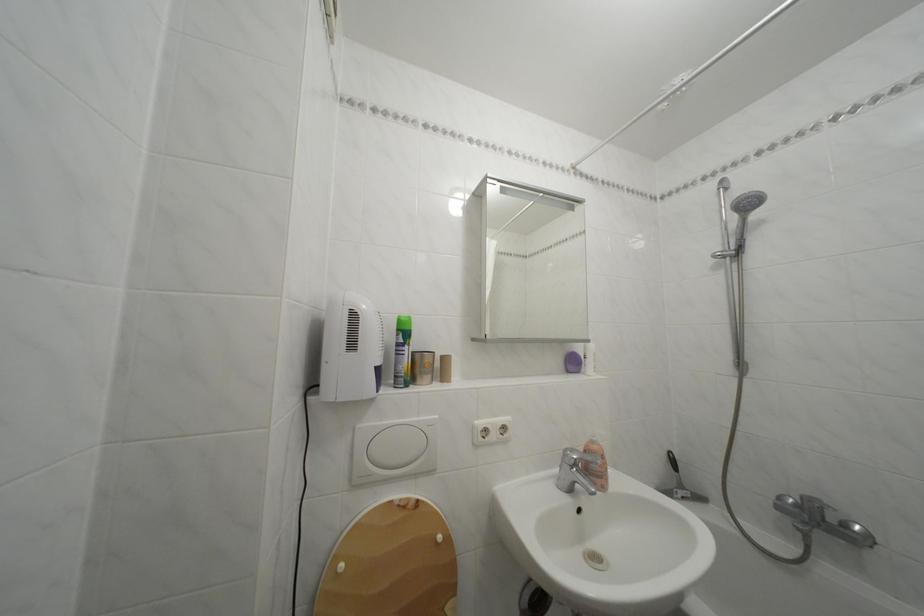
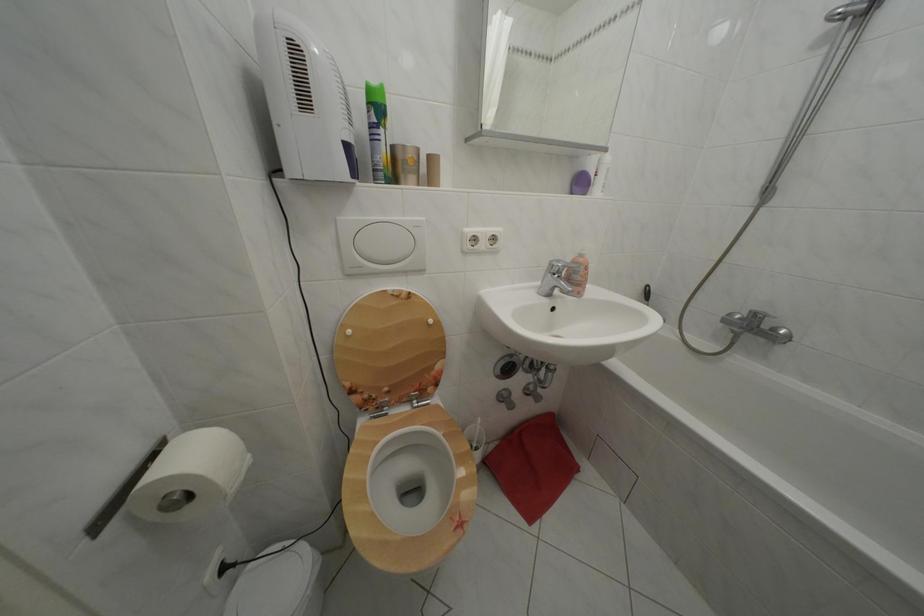
In the second image, find the point that corresponds to (x=368, y=432) in the first image.

(348, 225)